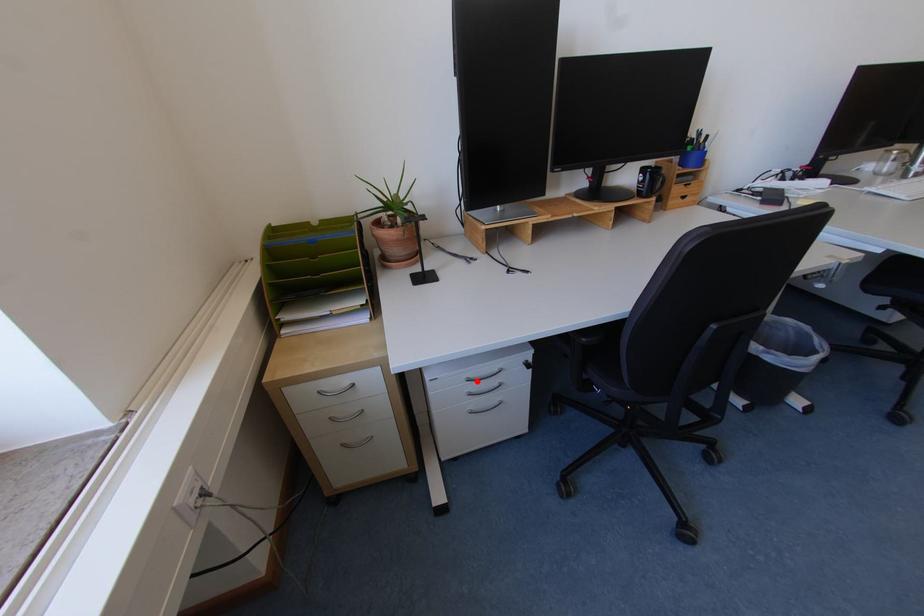
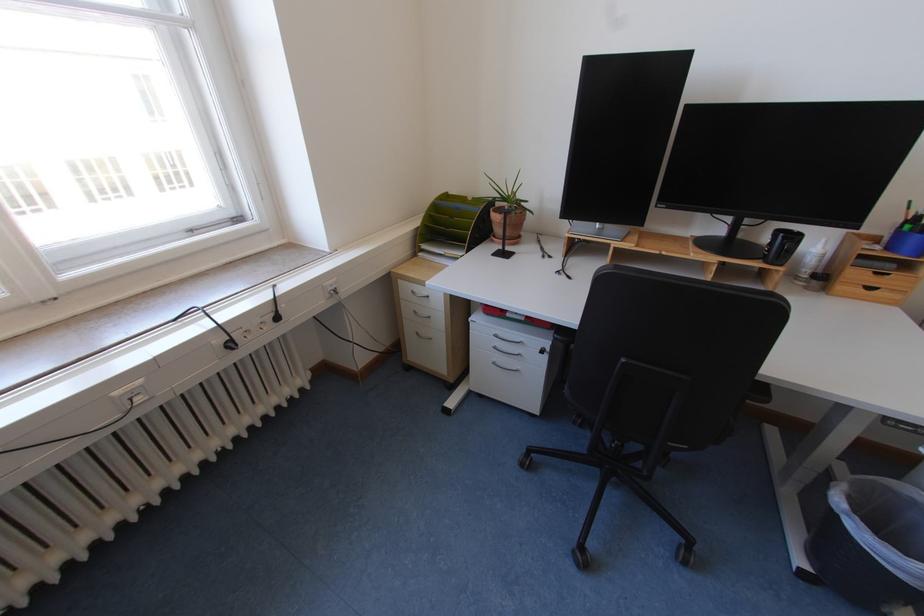
Question: I am providing you with two images of the same scene from different viewpoints. A red point is marked on the first image. At the location where the point appears in image 1, is it still visible in image 2?

Choices:
 (A) Yes
 (B) No

Answer: (A)